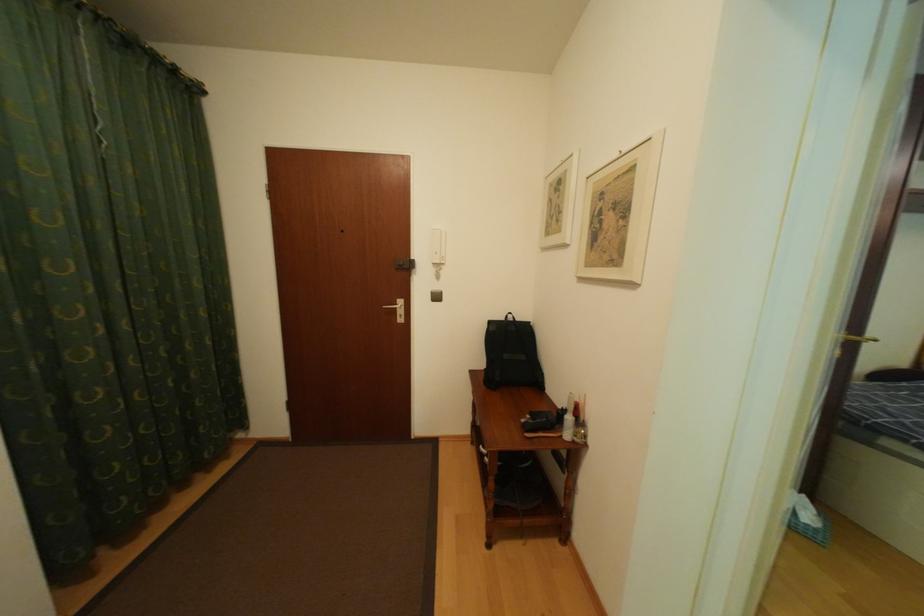
This screenshot has width=924, height=616. Identify the location of square light switch. (329, 182).